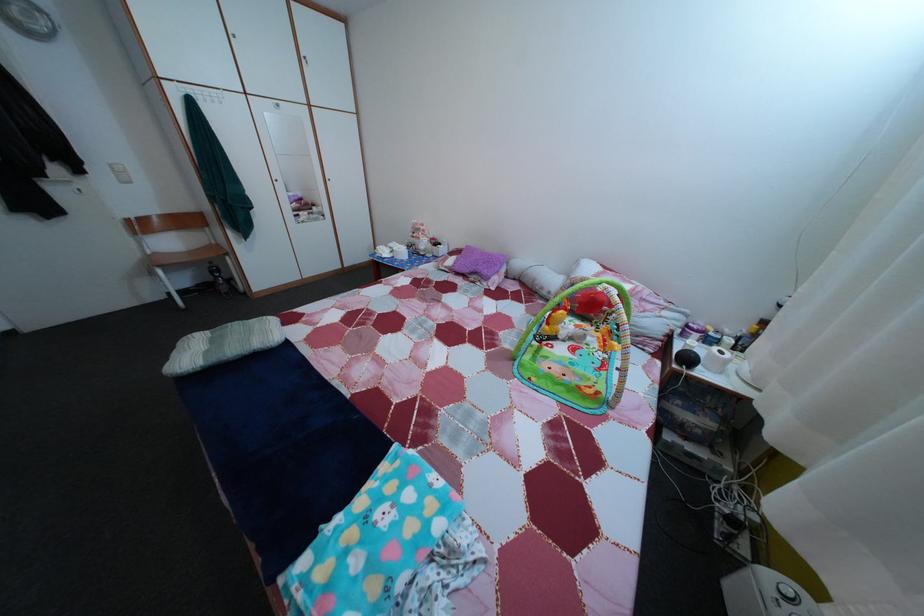
Find where to push the white light switch. Please return your answer as a coordinate pair (x, y).

(119, 172)